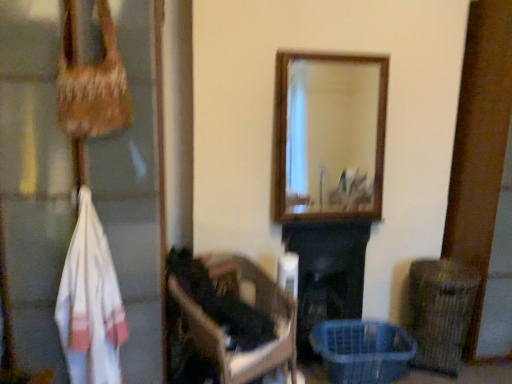
Measure the distance between black matte fireplace at center and camera.

A distance of 8.97 feet exists between black matte fireplace at center and camera.

Describe the element at coordinates (440, 312) in the screenshot. I see `brown wicker basket at lower right` at that location.

Where is `white woven towel at left`? This screenshot has height=384, width=512. white woven towel at left is located at coordinates (90, 302).

Where is `white woven bag at left`? The height and width of the screenshot is (384, 512). white woven bag at left is located at coordinates (33, 179).

In the scene shown: Measure the distance between point [403,334] and camera.

They are 9.50 feet apart.

Image resolution: width=512 pixels, height=384 pixels. I want to click on translucent plastic basket at lower right, so click(x=362, y=350).

The image size is (512, 384). I want to click on black matte fireplace at center, so click(x=327, y=273).

Is brown wicker basket at lower right outside of white woven towel at left?

Yes.

Who is smaller, brown wicker basket at lower right or white woven towel at left?

white woven towel at left is smaller.

Is brown wicker basket at lower right to the right of white woven towel at left from the viewer's perspective?

Yes, brown wicker basket at lower right is to the right of white woven towel at left.

Considering the points (448, 350) and (59, 286), which point is behind, point (448, 350) or point (59, 286)?

The point (448, 350) is farther.

Is white woven bag at left in contact with translucent plastic basket at lower right?

No, white woven bag at left is not touching translucent plastic basket at lower right.

How distant is white woven bag at left from translucent plastic basket at lower right?

A distance of 4.77 feet exists between white woven bag at left and translucent plastic basket at lower right.

From a real-world perspective, is white woven bag at left positioned above or below translucent plastic basket at lower right?

Clearly, from a real-world perspective, white woven bag at left is above translucent plastic basket at lower right.

In the scene shown: Is white woven bag at left completely or partially outside of translucent plastic basket at lower right?

That's correct, white woven bag at left is outside of translucent plastic basket at lower right.

From the image's perspective, between white woven towel at left and brown wicker basket at lower right, who is located below?

From the image's view, brown wicker basket at lower right is below.

From a real-world perspective, relative to brown wicker basket at lower right, is white woven towel at left vertically above or below?

From a real-world perspective, white woven towel at left is physically above brown wicker basket at lower right.

Could brown wicker basket at lower right be considered to be inside white woven towel at left?

No, brown wicker basket at lower right is not surrounded by white woven towel at left.

Is point (101, 366) behind point (439, 367)?

No, (101, 366) is in front of (439, 367).

Is dark brown wooden chair at center surrounding brown wicker basket at lower right?

No, brown wicker basket at lower right is located outside of dark brown wooden chair at center.

How different are the orientations of dark brown wooden chair at center and brown wicker basket at lower right in degrees?

dark brown wooden chair at center and brown wicker basket at lower right are facing 56.6 degrees away from each other.

Is dark brown wooden chair at center directly adjacent to brown wicker basket at lower right?

No, dark brown wooden chair at center is not touching brown wicker basket at lower right.

From a real-world perspective, is dark brown wooden chair at center above or below brown wicker basket at lower right?

In terms of real-world spatial position, dark brown wooden chair at center is above brown wicker basket at lower right.

Considering the sizes of objects brown wicker basket at lower right and dark brown wooden chair at center in the image provided, who is wider, brown wicker basket at lower right or dark brown wooden chair at center?

With larger width is dark brown wooden chair at center.

Is dark brown wooden chair at center at the back of brown wicker basket at lower right?

No, brown wicker basket at lower right's orientation is not away from dark brown wooden chair at center.

Between brown wicker basket at lower right and dark brown wooden chair at center, which one has more height?

dark brown wooden chair at center.

Considering the sizes of white woven bag at left and dark brown wooden chair at center in the image, is white woven bag at left wider or thinner than dark brown wooden chair at center?

white woven bag at left is wider than dark brown wooden chair at center.

The image size is (512, 384). There is a dark brown wooden chair at center. What are the coordinates of `glass door above it (from a real-world perspective)` in the screenshot? It's located at (33, 179).

Which of these two, white woven bag at left or dark brown wooden chair at center, stands taller?

Standing taller between the two is white woven bag at left.

Considering the positions of objects white woven bag at left and dark brown wooden chair at center in the image provided, who is in front, white woven bag at left or dark brown wooden chair at center?

white woven bag at left.

From the image's perspective, is dark brown wooden chair at center over white woven towel at left?

Incorrect, from the image's perspective, dark brown wooden chair at center is lower than white woven towel at left.

Image resolution: width=512 pixels, height=384 pixels. I want to click on furniture lying behind the white woven towel at left, so click(x=225, y=321).

Does dark brown wooden chair at center touch white woven towel at left?

No, dark brown wooden chair at center is not in contact with white woven towel at left.

Between dark brown wooden chair at center and white woven towel at left, which one has less height?

Standing shorter between the two is dark brown wooden chair at center.

Locate an element on the screen. clothing above the brown wicker basket at lower right (from a real-world perspective) is located at coordinates pos(90,302).

Find the location of a particular element. The height and width of the screenshot is (384, 512). basket located on the right of white woven bag at left is located at coordinates (362, 350).

When comparing their distances from brown wicker basket at lower right, does black matte fireplace at center or translucent plastic basket at lower right seem further?

black matte fireplace at center lies further to brown wicker basket at lower right than the other object.

Estimate the real-world distances between objects in this image. Which object is further from dark brown wooden chair at center, white woven towel at left or white woven bag at left?

white woven towel at left is further to dark brown wooden chair at center.

Which object lies further to the anchor point translucent plastic basket at lower right, black matte fireplace at center or white woven towel at left?

white woven towel at left is positioned further to the anchor translucent plastic basket at lower right.

When comparing their distances from brown wicker basket at lower right, does white woven bag at left or dark brown wooden chair at center seem further?

white woven bag at left is further to brown wicker basket at lower right.

Looking at the image, which one is located further to dark brown wooden chair at center, translucent plastic basket at lower right or white woven towel at left?

translucent plastic basket at lower right is positioned further to the anchor dark brown wooden chair at center.

Considering their positions, is white woven towel at left positioned further to black matte fireplace at center than brown wicker basket at lower right?

The object further to black matte fireplace at center is white woven towel at left.

Estimate the real-world distances between objects in this image. Which object is closer to white woven towel at left, black matte fireplace at center or white woven bag at left?

Based on the image, white woven bag at left appears to be nearer to white woven towel at left.

From the image, which object appears to be nearer to dark brown wooden chair at center, translucent plastic basket at lower right or black matte fireplace at center?

Based on the image, black matte fireplace at center appears to be nearer to dark brown wooden chair at center.

Image resolution: width=512 pixels, height=384 pixels. In order to click on furniture located between white woven towel at left and black matte fireplace at center in the left-right direction in this screenshot , I will do `click(225, 321)`.

Where is `furniture situated between white woven towel at left and brown wicker basket at lower right from left to right`? This screenshot has width=512, height=384. furniture situated between white woven towel at left and brown wicker basket at lower right from left to right is located at coordinates (225, 321).

Find the location of a particular element. This screenshot has height=384, width=512. fireplace between dark brown wooden chair at center and translucent plastic basket at lower right is located at coordinates (327, 273).

The height and width of the screenshot is (384, 512). Identify the location of furniture situated between white woven bag at left and brown wicker basket at lower right from left to right. (225, 321).